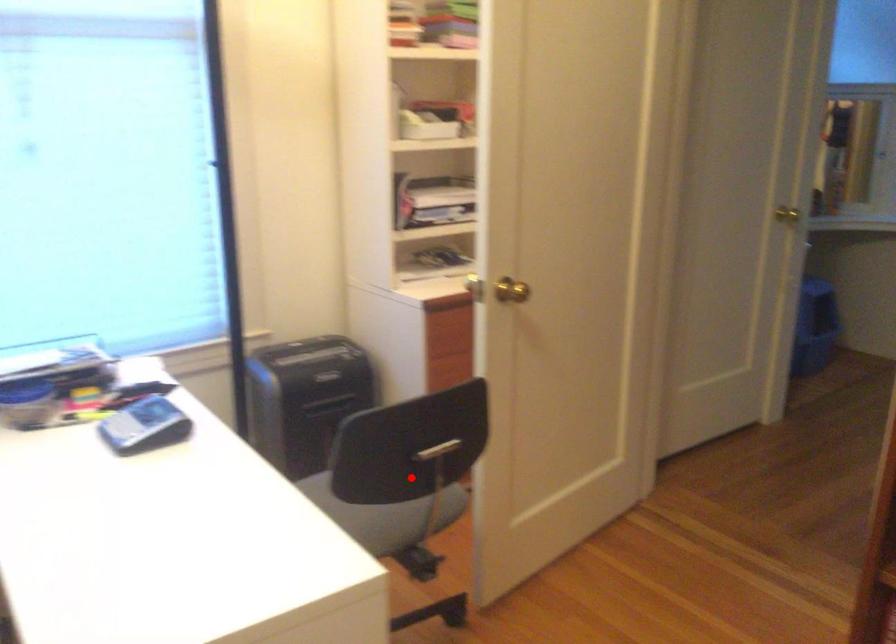
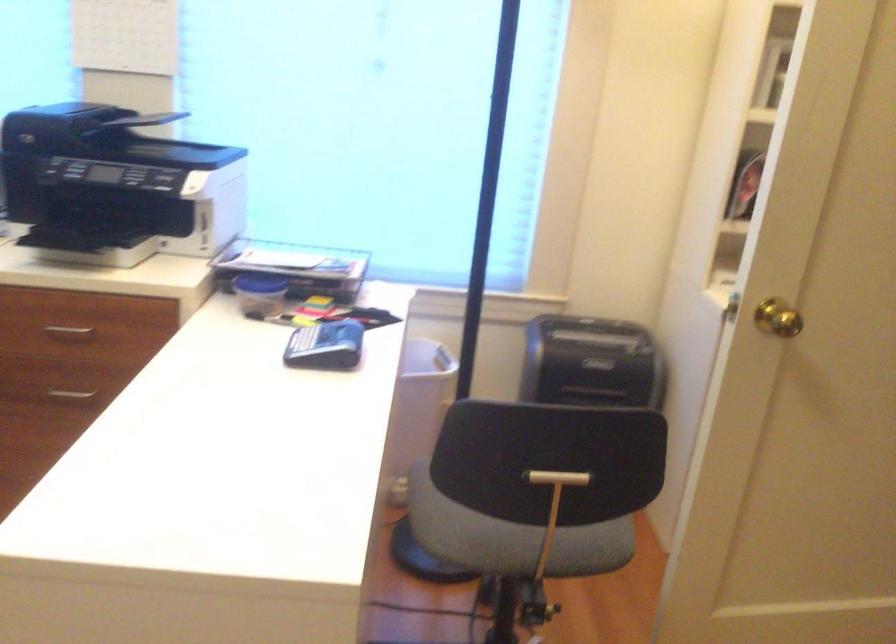
Question: I am providing you with two images of the same scene from different viewpoints. Image1 has a red point marked. In image2, the corresponding 3D location appears at what relative position? Reply with the corresponding letter.

Choices:
 (A) Closer
 (B) Farther

Answer: (A)